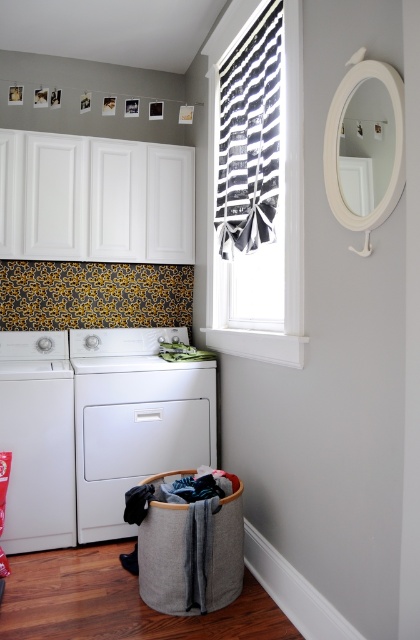
Question: Can you confirm if black/white striped fabric at center is thinner than white matte washing machine at lower left?

Choices:
 (A) yes
 (B) no

Answer: (A)

Question: Is white matte washing machine at left to the left of gray fabric laundry basket at lower right from the viewer's perspective?

Choices:
 (A) no
 (B) yes

Answer: (B)

Question: Which object is farther from the camera taking this photo?

Choices:
 (A) white matte washing machine at left
 (B) black/white striped fabric at center
 (C) white matte washing machine at lower left

Answer: (C)

Question: Which of the following is the farthest from the observer?

Choices:
 (A) (281, 42)
 (B) (183, 554)

Answer: (A)

Question: Is black/white striped fabric at center to the left of white matte washing machine at left from the viewer's perspective?

Choices:
 (A) yes
 (B) no

Answer: (B)

Question: Which of the following is the closest to the observer?

Choices:
 (A) black/white striped fabric at center
 (B) gray fabric laundry basket at lower right
 (C) white matte washing machine at lower left
 (D) white matte washing machine at left

Answer: (A)